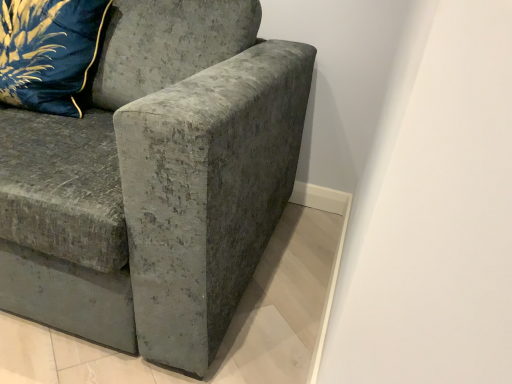
Question: Is velvet blue pillow at upper left beside velvet gray couch at center?

Choices:
 (A) yes
 (B) no

Answer: (B)

Question: From a real-world perspective, is velvet blue pillow at upper left physically below velvet gray couch at center?

Choices:
 (A) yes
 (B) no

Answer: (B)

Question: Is velvet blue pillow at upper left taller than velvet gray couch at center?

Choices:
 (A) no
 (B) yes

Answer: (A)

Question: Is velvet blue pillow at upper left at the left side of velvet gray couch at center?

Choices:
 (A) yes
 (B) no

Answer: (A)

Question: Is velvet blue pillow at upper left positioned behind velvet gray couch at center?

Choices:
 (A) yes
 (B) no

Answer: (A)

Question: Is velvet blue pillow at upper left bigger than velvet gray couch at center?

Choices:
 (A) no
 (B) yes

Answer: (A)

Question: Does velvet gray couch at center come in front of velvet blue pillow at upper left?

Choices:
 (A) yes
 (B) no

Answer: (A)

Question: Considering the relative sizes of velvet gray couch at center and velvet blue pillow at upper left in the image provided, is velvet gray couch at center shorter than velvet blue pillow at upper left?

Choices:
 (A) yes
 (B) no

Answer: (B)

Question: From a real-world perspective, is velvet gray couch at center below velvet blue pillow at upper left?

Choices:
 (A) yes
 (B) no

Answer: (A)

Question: Is velvet gray couch at center further to the viewer compared to velvet blue pillow at upper left?

Choices:
 (A) no
 (B) yes

Answer: (A)

Question: From the image's perspective, would you say velvet gray couch at center is shown under velvet blue pillow at upper left?

Choices:
 (A) yes
 (B) no

Answer: (A)

Question: Is velvet gray couch at center located outside velvet blue pillow at upper left?

Choices:
 (A) no
 (B) yes

Answer: (B)

Question: Considering their positions, is velvet blue pillow at upper left located in front of or behind velvet gray couch at center?

Choices:
 (A) front
 (B) behind

Answer: (B)